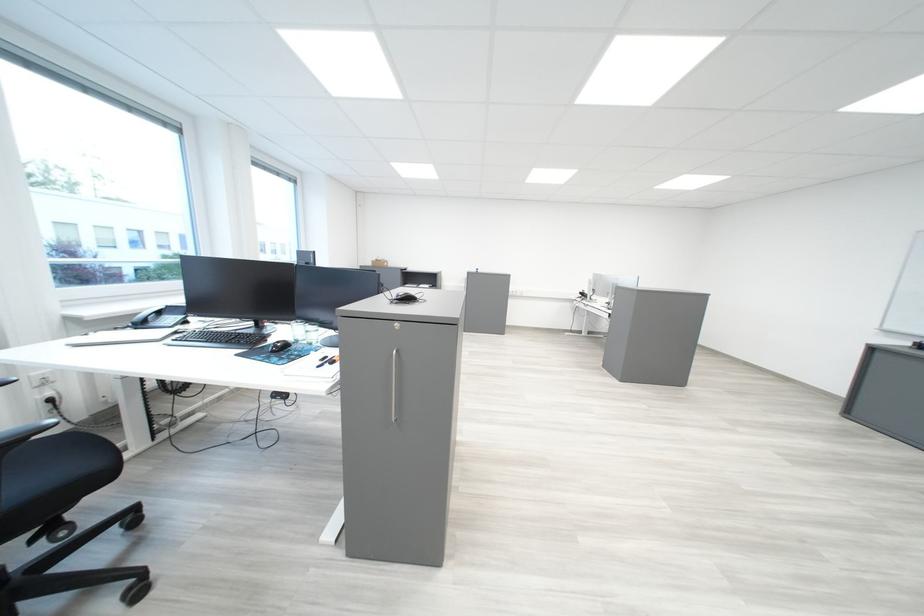
You are a GUI agent. You are given a task and a screenshot of the screen. Output one action in this format:
    pyautogui.click(x=<x>, y=<y>)
    Task: Click on the metal cabinet handle
    The image size is (924, 616).
    Given the screenshot: What is the action you would take?
    pyautogui.click(x=393, y=385)